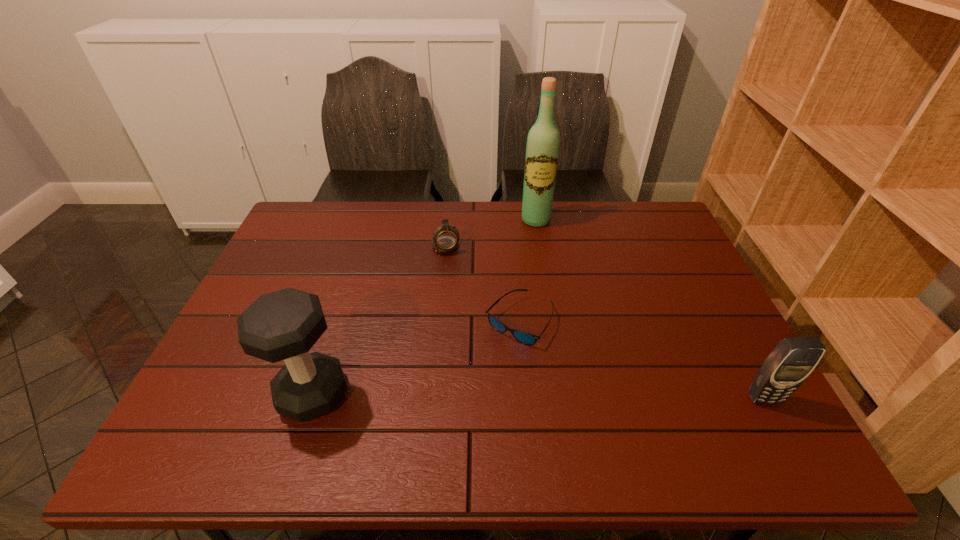
In the image, there is a desktop. Where is `vacant space at the near left corner`? vacant space at the near left corner is located at coordinates (268, 381).

This screenshot has width=960, height=540. What are the coordinates of `vacant area at the far right corner` in the screenshot? It's located at (643, 222).

Image resolution: width=960 pixels, height=540 pixels. I want to click on free space that is in between the cellular telephone and the dumbbell, so click(539, 396).

Locate an element on the screen. empty space that is in between the sunglasses and the leftmost object is located at coordinates (416, 357).

The image size is (960, 540). Find the location of `free space between the wine bottle and the shortest object`. free space between the wine bottle and the shortest object is located at coordinates (528, 271).

Find the location of a particular element. The image size is (960, 540). free space between the shortest object and the cellular telephone is located at coordinates (642, 360).

This screenshot has width=960, height=540. I want to click on free space between the wine bottle and the shortest object, so click(528, 271).

Where is `vacant space that is in between the third farthest object and the fourth nearest object`? The image size is (960, 540). vacant space that is in between the third farthest object and the fourth nearest object is located at coordinates (483, 282).

At what (x,y) coordinates should I click in order to perform the action: click on free space between the second tallest object and the cellular telephone. Please return your answer as a coordinate pair (x, y). The height and width of the screenshot is (540, 960). Looking at the image, I should click on (x=539, y=396).

The width and height of the screenshot is (960, 540). Identify the location of vacant region between the farthest object and the cellular telephone. (650, 309).